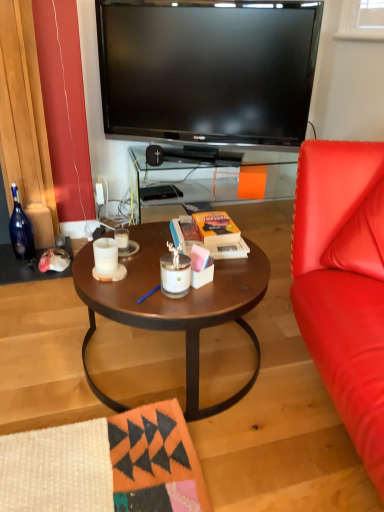
Locate an element on the screen. free space above matte brown coffee table at center (from a real-world perspective) is located at coordinates (192, 282).